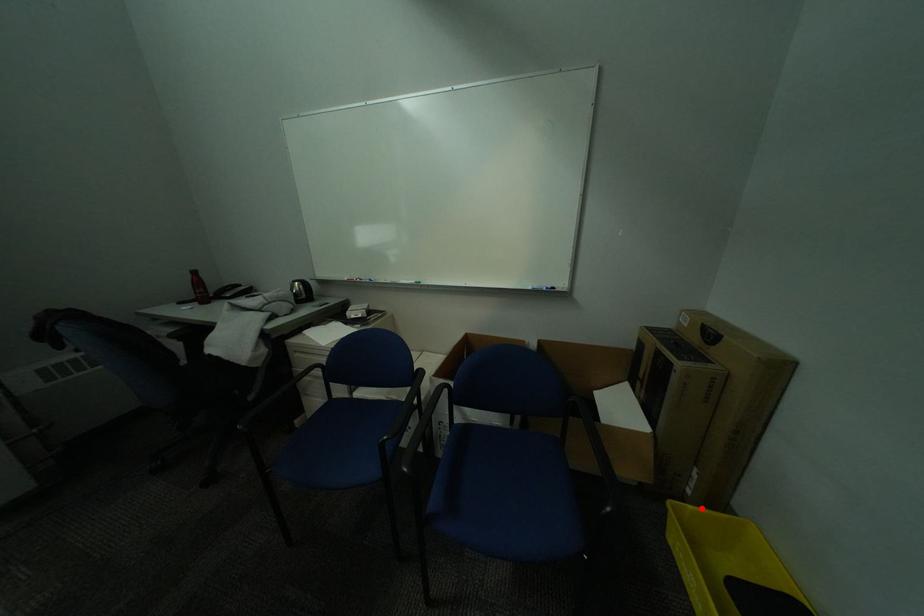
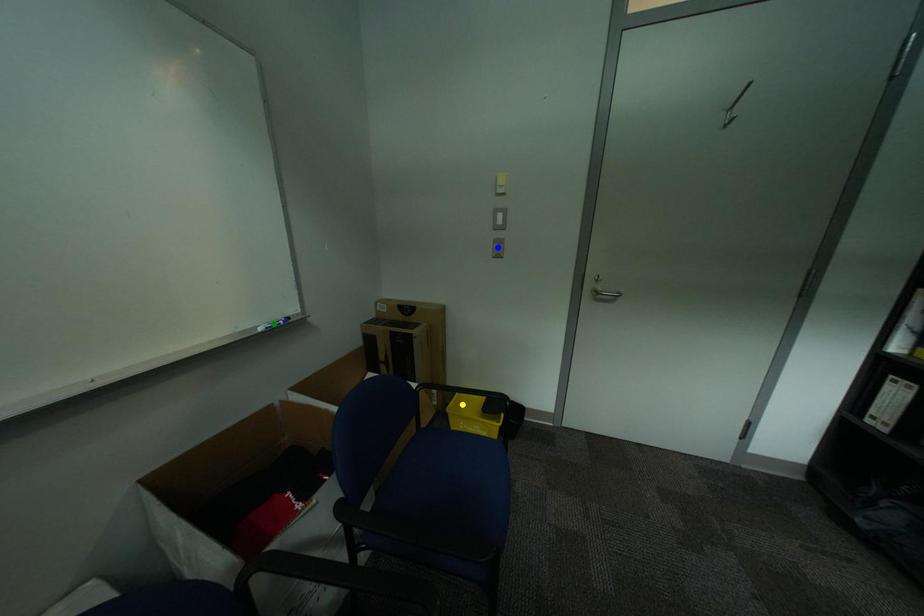
Question: I am providing you with two images of the same scene from different viewpoints. A red point is marked on the first image. You are given multiple points on the second image. In image 2, which mark is for the same physical point as the one in image 1?

Choices:
 (A) blue point
 (B) yellow point
 (C) green point

Answer: (B)